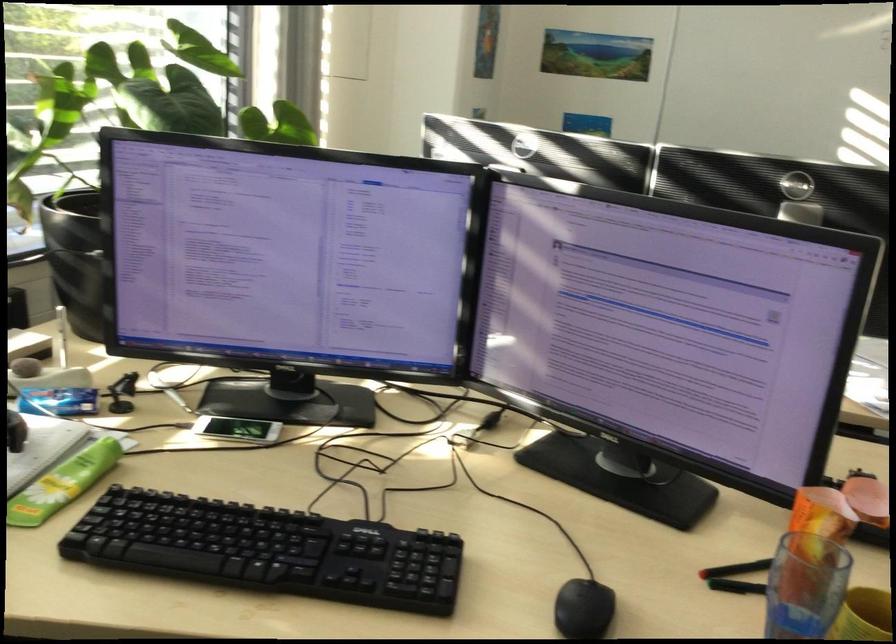
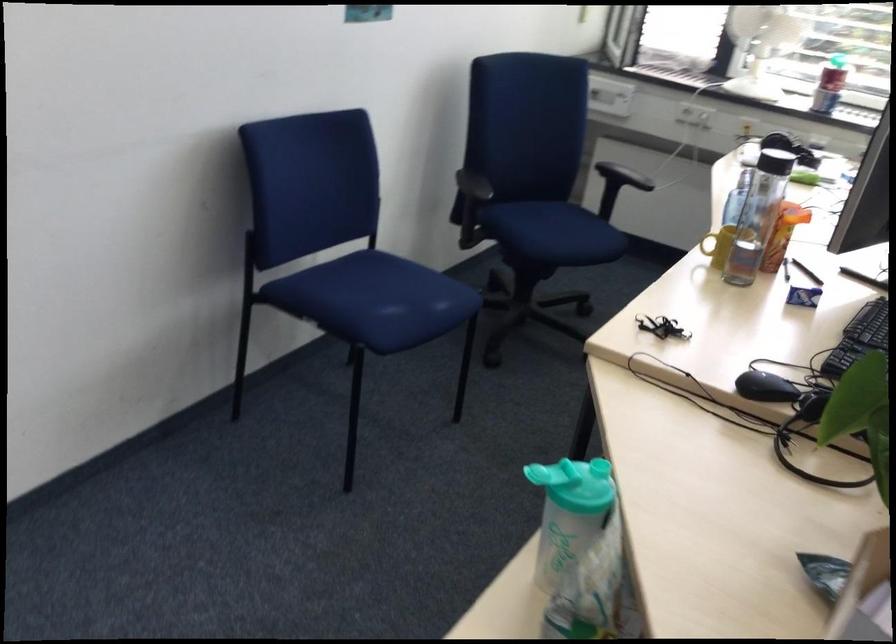
Question: I am providing you with two images of the same scene from different viewpoints. Please identify which objects are invisible in image2.

Choices:
 (A) black chair armrest
 (B) keyboard key
 (C) cabinet mirror door
 (D) blue chair sitting surface

Answer: (B)